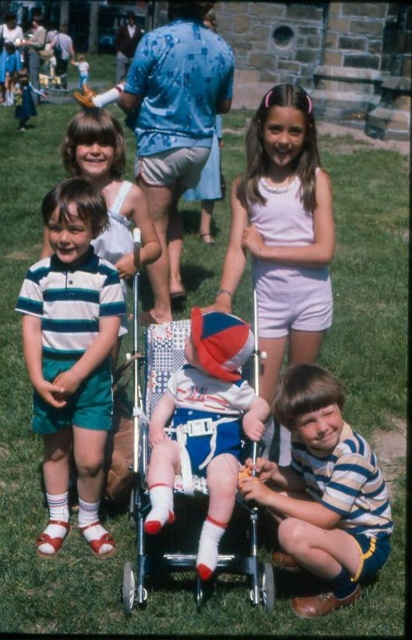
Can you confirm if teal striped polo shirt at center is positioned above matte blue and white striped shirt at center?

Yes.

Which is in front, point (96, 490) or point (267, 410)?

Point (267, 410) is more forward.

Where is `teal striped polo shirt at center`? Image resolution: width=412 pixels, height=640 pixels. teal striped polo shirt at center is located at coordinates (72, 356).

What are the coordinates of `teal striped polo shirt at center` in the screenshot? It's located at (72, 356).

Does striped cotton shirt at lower right have a larger size compared to matte blue and white striped shirt at center?

Indeed, striped cotton shirt at lower right has a larger size compared to matte blue and white striped shirt at center.

Locate an element on the screen. striped cotton shirt at lower right is located at coordinates (323, 490).

Locate an element on the screen. striped cotton shirt at lower right is located at coordinates [x=323, y=490].

Between matte blue shirt at center and matte blue and white striped shirt at center, which one appears on the right side from the viewer's perspective?

matte blue and white striped shirt at center

Can you confirm if matte blue shirt at center is positioned to the right of matte blue and white striped shirt at center?

In fact, matte blue shirt at center is to the left of matte blue and white striped shirt at center.

Is point (168, 221) less distant than point (210, 317)?

No, it is not.

Where is `matte blue shirt at center`? matte blue shirt at center is located at coordinates (175, 125).